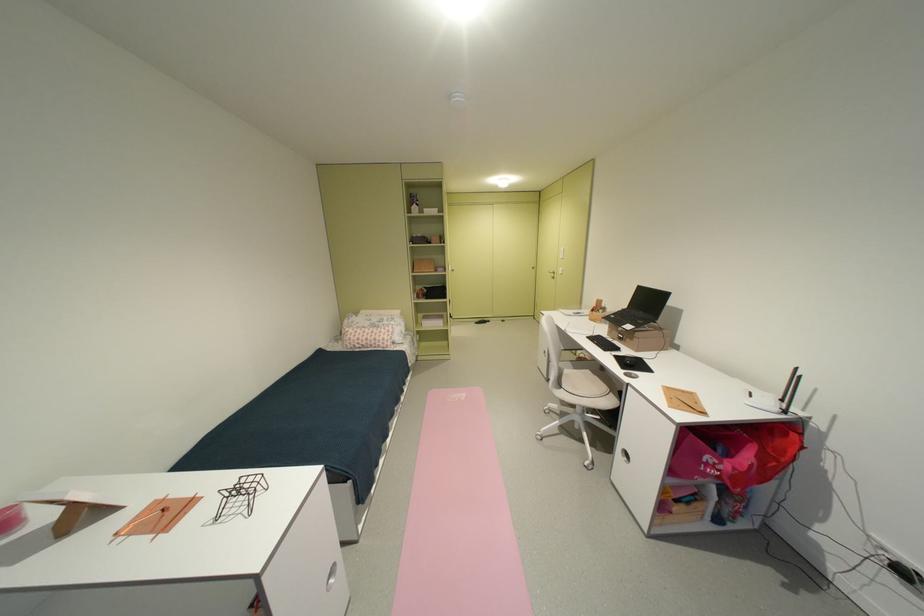
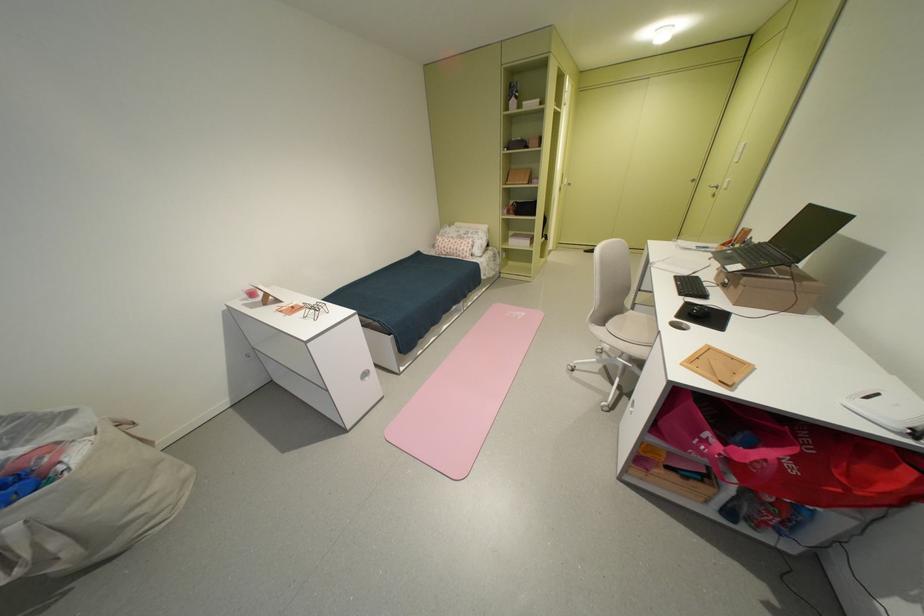
How did the camera likely rotate?

The camera rotated toward left-down.